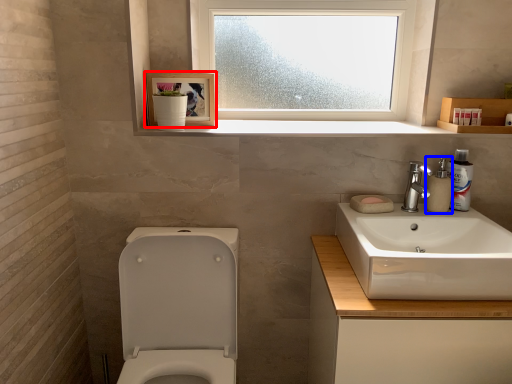
Question: Which object is closer to the camera taking this photo, picture frame (highlighted by a red box) or soap dispenser (highlighted by a blue box)?

Choices:
 (A) picture frame
 (B) soap dispenser

Answer: (B)